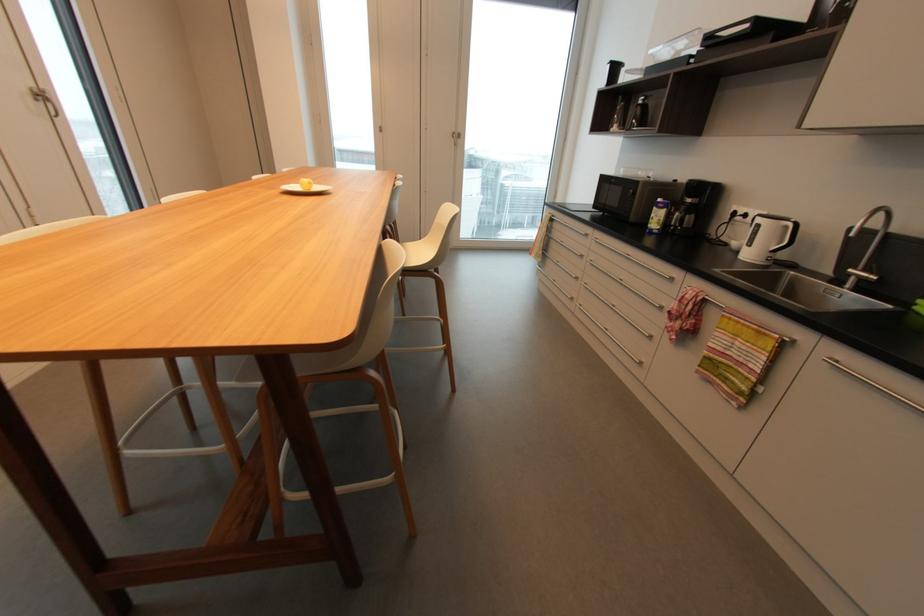
Identify the location of towel rack handle. (685, 313).